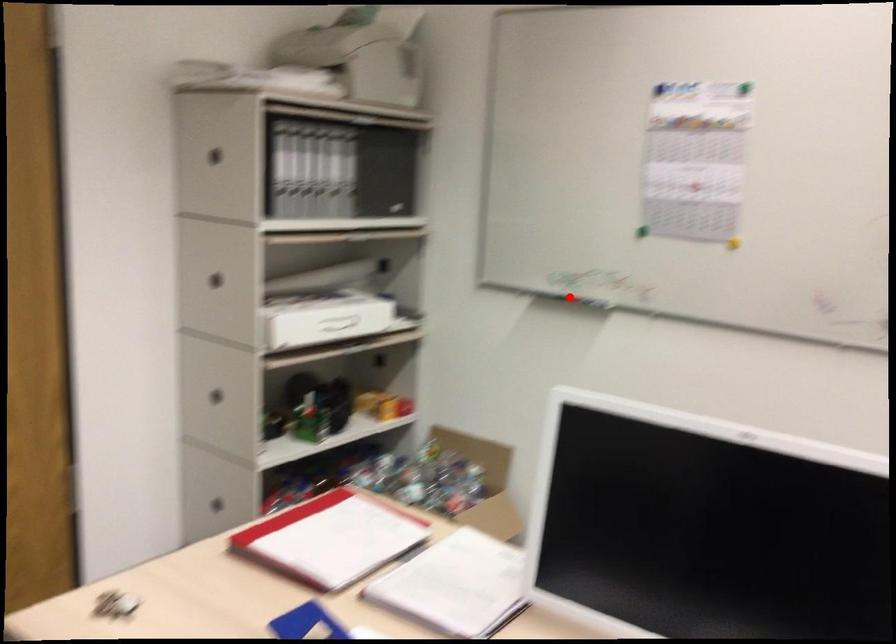
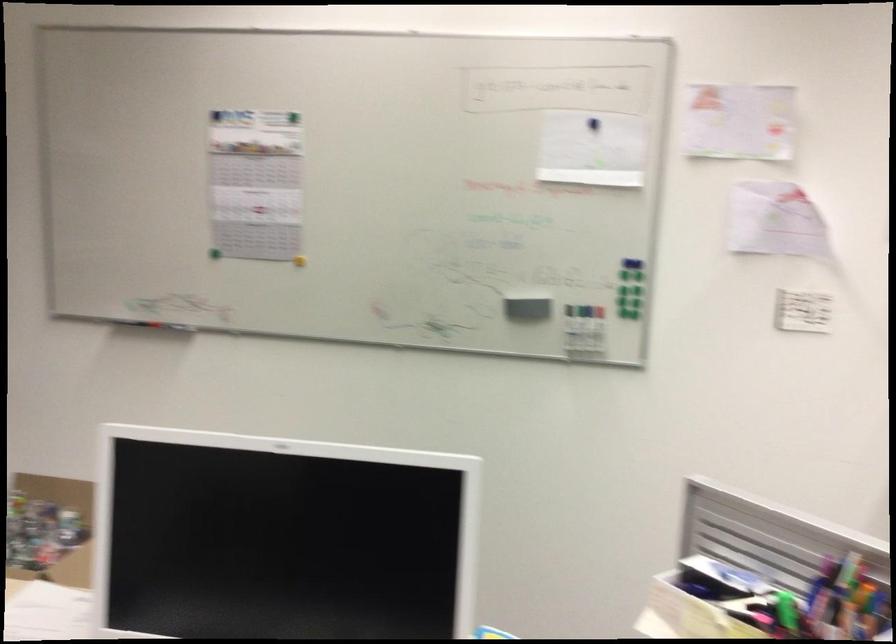
Where in the second image is the point corresponding to the highlighted location from the first image?

(158, 325)